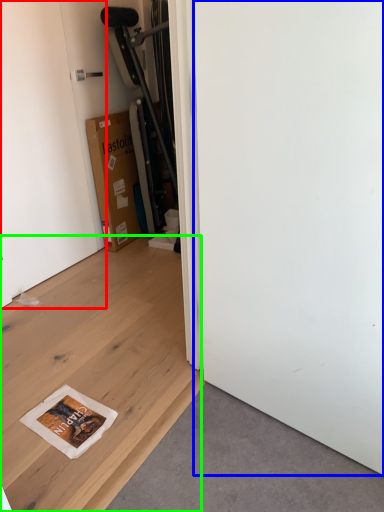
Question: Estimate the real-world distances between objects in this image. Which object is farther from door (highlighted by a red box), screen door (highlighted by a blue box) or plywood (highlighted by a green box)?

Choices:
 (A) screen door
 (B) plywood

Answer: (A)